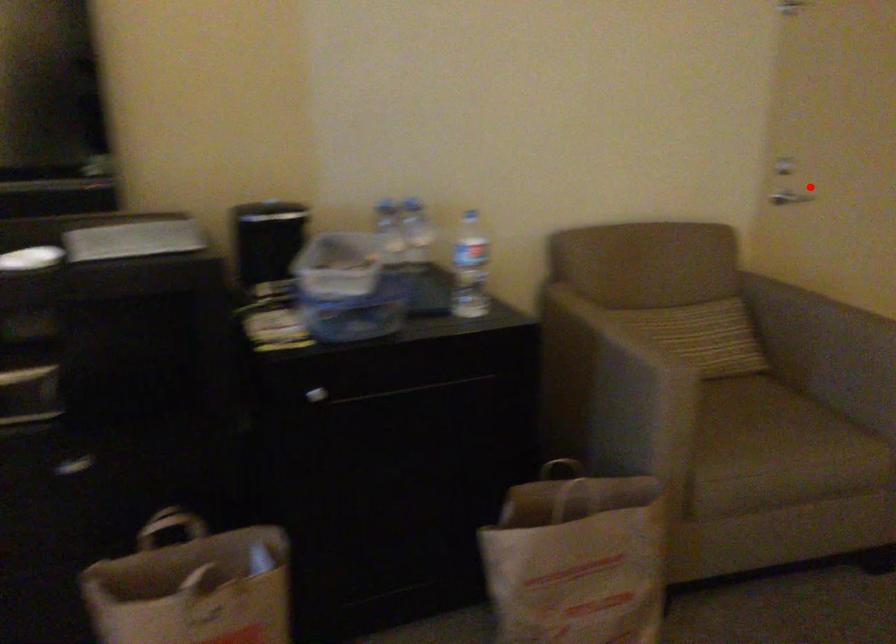
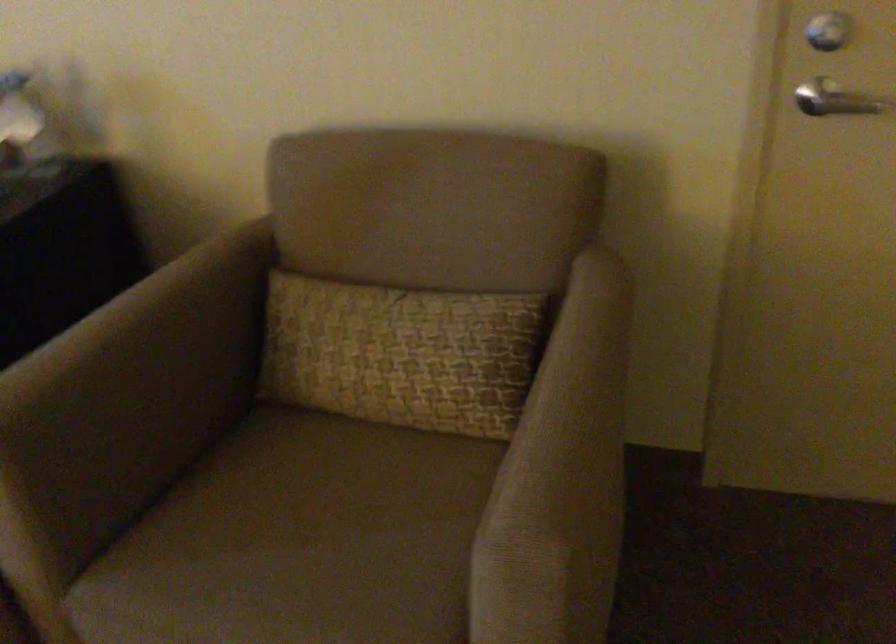
Question: I am providing you with two images of the same scene from different viewpoints. A red point is shown in image1. For the corresponding object point in image2, is it positioned nearer or farther from the camera?

Choices:
 (A) Nearer
 (B) Farther

Answer: (A)